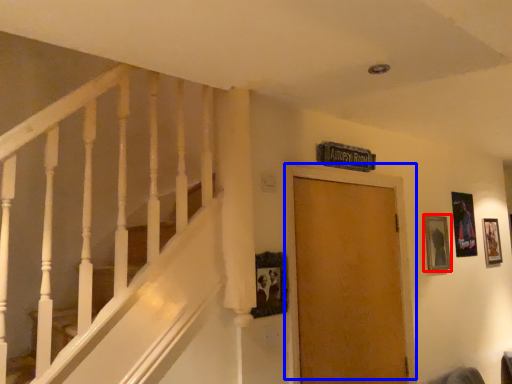
Question: Which object is closer to the camera taking this photo, picture frame (highlighted by a red box) or door (highlighted by a blue box)?

Choices:
 (A) picture frame
 (B) door

Answer: (B)